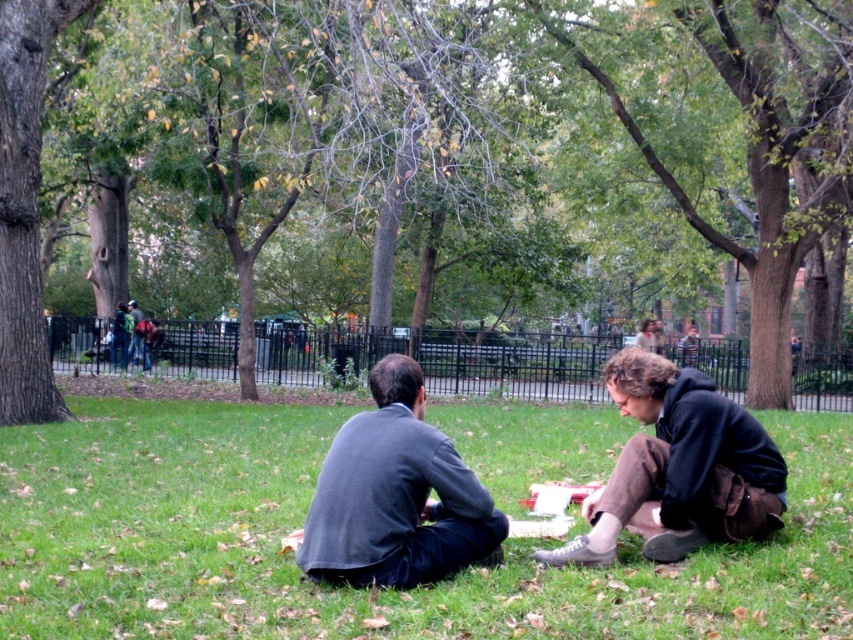
You are a park visitor who wants to place a small picnic basket between the green grass at center and the dark gray sweater at center. How far apart are these two items from each other?

The green grass at center is 4.04 meters from the dark gray sweater at center, so the picnic basket can be placed between them at that distance.

You are a painter setting up your easel in the park to paint the scene. You want to ensure that the brown textured tree at center and the dark brown hoodie at lower right are proportionally accurate in your painting. Which object should you make larger in your artwork?

The brown textured tree at center should be made larger than the dark brown hoodie at lower right in the painting since the brown textured tree at center is bigger than dark brown hoodie at lower right in the actual scene.

You are standing in the park and notice the brown textured tree at center and the green grass at center. Which object is closer to you?

The brown textured tree at center is closer to you than the green grass at center.